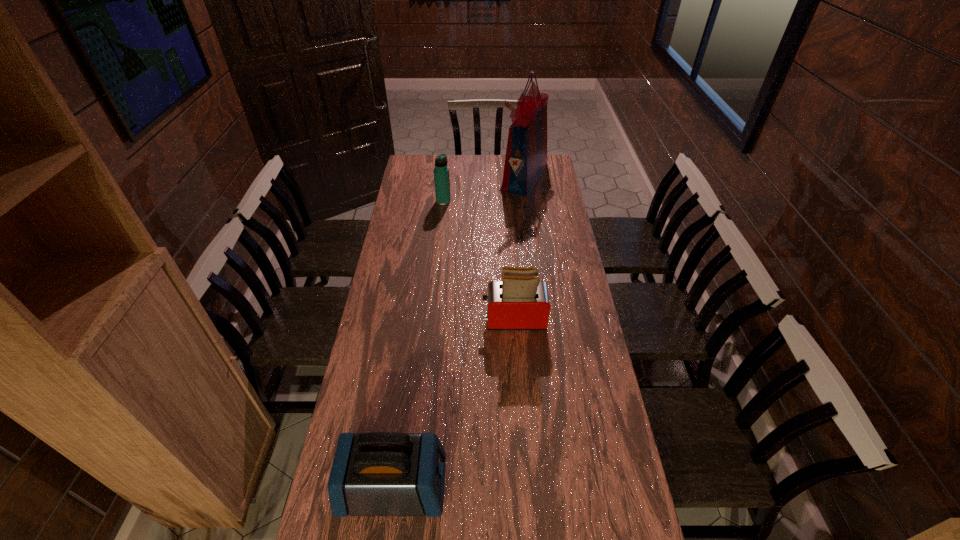
At what (x,y) coordinates should I click in order to perform the action: click on grocery bag. Please return your answer as a coordinate pair (x, y). This screenshot has width=960, height=540. Looking at the image, I should click on (526, 155).

The image size is (960, 540). What are the coordinates of `the farthest object` in the screenshot? It's located at tap(526, 155).

Where is `the second farthest object`? the second farthest object is located at coordinates (441, 172).

You are a GUI agent. You are given a task and a screenshot of the screen. Output one action in this format:
    pyautogui.click(x=<x>, y=<y>)
    Task: Click on the farther toaster
    
    Given the screenshot: What is the action you would take?
    pyautogui.click(x=520, y=301)

Locate an element on the screen. the right toaster is located at coordinates tap(520, 301).

At what (x,y) coordinates should I click in order to perform the action: click on the left toaster. Please return your answer as a coordinate pair (x, y). This screenshot has height=540, width=960. Looking at the image, I should click on (380, 473).

This screenshot has height=540, width=960. I want to click on the nearer toaster, so click(x=380, y=473).

Find the location of a particular element. Image resolution: width=960 pixels, height=540 pixels. blank space located on the front-facing side of the tallest object is located at coordinates (452, 176).

Identify the location of free spot located on the front-facing side of the tallest object. (466, 176).

This screenshot has height=540, width=960. Find the location of `free space located 0.300m on the front-facing side of the tallest object`. free space located 0.300m on the front-facing side of the tallest object is located at coordinates (440, 176).